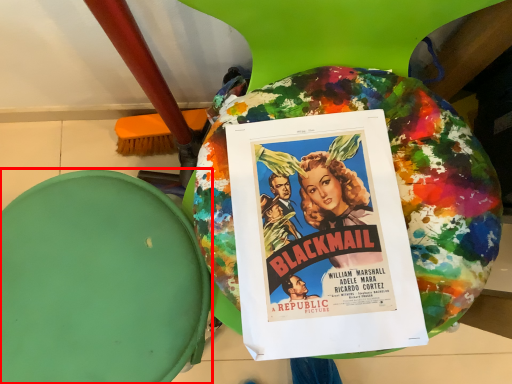
Question: In this image, where is bean bag chair (annotated by the red box) located relative to poster?

Choices:
 (A) right
 (B) left

Answer: (B)